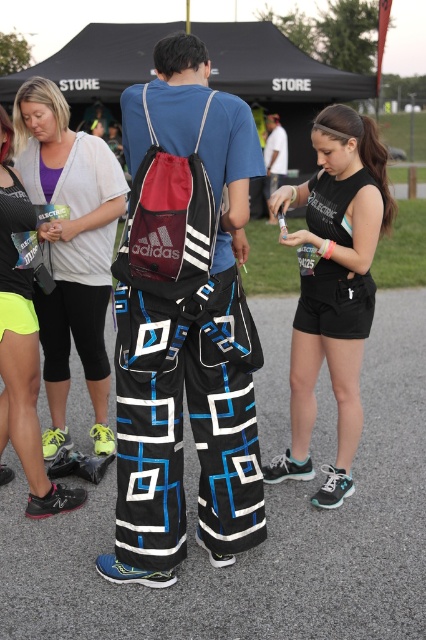
You are standing at the point with coordinates point [278,163] and want to walk to the registration booth under the black canopy tent labeled STUHE STORE. There is a person wearing a blue T shirt and black Adidas drawstring backpack with red and black accents located at point [175,198]. Will you pass by this person on your way to the tent?

Yes, because point [175,198] is in front of point [278,163], so walking towards the tent from point [278,163] would require passing by the person at point [175,198].